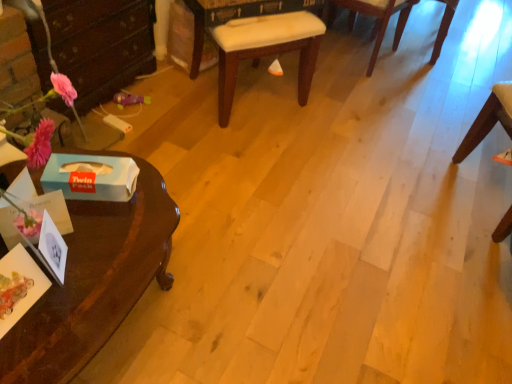
Measure the distance between point (45, 317) and camera.

They are 38.50 inches apart.

This screenshot has width=512, height=384. What do you see at coordinates (265, 49) in the screenshot?
I see `white fabric cushion at center, positioned as the first chair in left-to-right order` at bounding box center [265, 49].

Describe the element at coordinates (488, 120) in the screenshot. This screenshot has width=512, height=384. I see `wooden chair at right, acting as the second chair starting from the right` at that location.

Where is `glossy dark wood desk at left`? The height and width of the screenshot is (384, 512). glossy dark wood desk at left is located at coordinates (95, 281).

In the scene shown: Who is more distant, glossy dark wood desk at left or white cardboard box at lower left, which ranks as the 1th box in back-to-front order?

white cardboard box at lower left, which ranks as the 1th box in back-to-front order, is more distant.

Locate an element on the screen. desk below the white cardboard box at lower left, which ranks as the 1th box in back-to-front order (from the image's perspective) is located at coordinates click(x=95, y=281).

Is glossy dark wood desk at left directly adjacent to white cardboard box at lower left, the 2th box when ordered from front to back?

glossy dark wood desk at left and white cardboard box at lower left, the 2th box when ordered from front to back, are clearly separated.

Looking at this image, considering the sizes of objects glossy dark wood desk at left and white cardboard box at lower left, which ranks as the 1th box in back-to-front order, in the image provided, who is thinner, glossy dark wood desk at left or white cardboard box at lower left, which ranks as the 1th box in back-to-front order,?

white cardboard box at lower left, which ranks as the 1th box in back-to-front order.

From the image's perspective, which one is positioned higher, blue paper tissue box at left, positioned as the 1th box in front-to-back order, or wooden chair at right, acting as the second chair starting from the right?

wooden chair at right, acting as the second chair starting from the right, from the image's perspective.

From a real-world perspective, who is located higher, blue paper tissue box at left, positioned as the 1th box in front-to-back order, or wooden chair at right, acting as the second chair starting from the right?

blue paper tissue box at left, positioned as the 1th box in front-to-back order, from a real-world perspective.

Is blue paper tissue box at left, positioned as the 1th box in front-to-back order, oriented away from wooden chair at right, arranged as the second chair when viewed from the left?

No.

How many degrees apart are the facing directions of blue paper tissue box at left, the second box in the back-to-front sequence, and wooden chair at right, arranged as the second chair when viewed from the left?

The angular difference between blue paper tissue box at left, the second box in the back-to-front sequence, and wooden chair at right, arranged as the second chair when viewed from the left, is 124 degrees.

Which is further, (141, 268) or (233, 35)?

The point (233, 35) is farther.

Which object is further away from the camera, glossy dark wood desk at left or white fabric cushion at center, which ranks as the 3th chair in right-to-left order?

Positioned behind is white fabric cushion at center, which ranks as the 3th chair in right-to-left order.

Which of these two, glossy dark wood desk at left or white fabric cushion at center, positioned as the first chair in left-to-right order, stands shorter?

Standing shorter between the two is glossy dark wood desk at left.

How far apart are glossy dark wood desk at left and white fabric cushion at center, which ranks as the 3th chair in right-to-left order?

The distance of glossy dark wood desk at left from white fabric cushion at center, which ranks as the 3th chair in right-to-left order, is 1.10 meters.

From the image's perspective, is blue paper tissue box at left, positioned as the 1th box in front-to-back order, positioned above or below white fabric cushion at center, which ranks as the 3th chair in right-to-left order?

blue paper tissue box at left, positioned as the 1th box in front-to-back order, is situated lower than white fabric cushion at center, which ranks as the 3th chair in right-to-left order, in the image.

Considering the sizes of objects blue paper tissue box at left, the second box in the back-to-front sequence, and white fabric cushion at center, positioned as the first chair in left-to-right order, in the image provided, who is taller, blue paper tissue box at left, the second box in the back-to-front sequence, or white fabric cushion at center, positioned as the first chair in left-to-right order,?

white fabric cushion at center, positioned as the first chair in left-to-right order, is taller.

In the scene shown: Can you tell me how much blue paper tissue box at left, positioned as the 1th box in front-to-back order, and white fabric cushion at center, positioned as the first chair in left-to-right order, differ in facing direction?

blue paper tissue box at left, positioned as the 1th box in front-to-back order, and white fabric cushion at center, positioned as the first chair in left-to-right order, are facing 0.922 degrees away from each other.

Does blue paper tissue box at left, the second box in the back-to-front sequence, turn towards white fabric cushion at center, which ranks as the 3th chair in right-to-left order?

No, blue paper tissue box at left, the second box in the back-to-front sequence, is not aimed at white fabric cushion at center, which ranks as the 3th chair in right-to-left order.

Between wooden chair at right, arranged as the second chair when viewed from the left, and white fabric cushion at center, positioned as the first chair in left-to-right order, which one has smaller width?

Thinner between the two is wooden chair at right, arranged as the second chair when viewed from the left.

Considering the sizes of objects wooden chair at right, arranged as the second chair when viewed from the left, and white fabric cushion at center, positioned as the first chair in left-to-right order, in the image provided, who is shorter, wooden chair at right, arranged as the second chair when viewed from the left, or white fabric cushion at center, positioned as the first chair in left-to-right order,?

white fabric cushion at center, positioned as the first chair in left-to-right order, is shorter.

Is wooden chair at right, acting as the second chair starting from the right, positioned with its back to white fabric cushion at center, positioned as the first chair in left-to-right order?

No, wooden chair at right, acting as the second chair starting from the right, is not facing away from white fabric cushion at center, positioned as the first chair in left-to-right order.

Looking at the image, does wooden chair at right, arranged as the second chair when viewed from the left, seem bigger or smaller compared to white fabric cushion at center, which ranks as the 3th chair in right-to-left order?

Clearly, wooden chair at right, arranged as the second chair when viewed from the left, is smaller in size than white fabric cushion at center, which ranks as the 3th chair in right-to-left order.

Does wooden chair at right, arranged as the second chair when viewed from the left, have a greater height compared to glossy dark wood desk at left?

Yes, wooden chair at right, arranged as the second chair when viewed from the left, is taller than glossy dark wood desk at left.

How different are the orientations of wooden chair at right, arranged as the second chair when viewed from the left, and glossy dark wood desk at left in degrees?

The angular difference between wooden chair at right, arranged as the second chair when viewed from the left, and glossy dark wood desk at left is 156 degrees.

From a real-world perspective, is wooden chair at right, arranged as the second chair when viewed from the left, on glossy dark wood desk at left?

Yes, from a real-world perspective, wooden chair at right, arranged as the second chair when viewed from the left, is above glossy dark wood desk at left.

Does point (503, 121) come in front of point (442, 29)?

That is True.

Is wooden chair at right, arranged as the second chair when viewed from the left, bigger or smaller than wooden chair at upper right, which ranks as the first chair in right-to-left order?

Clearly, wooden chair at right, arranged as the second chair when viewed from the left, is smaller in size than wooden chair at upper right, which ranks as the first chair in right-to-left order.

Which object is closer to the camera taking this photo, wooden chair at right, acting as the second chair starting from the right, or wooden chair at upper right, the third chair in the left-to-right sequence?

Positioned in front is wooden chair at right, acting as the second chair starting from the right.

Is the surface of wooden chair at right, acting as the second chair starting from the right, in direct contact with wooden chair at upper right, which ranks as the first chair in right-to-left order?

No, wooden chair at right, acting as the second chair starting from the right, is not with wooden chair at upper right, which ranks as the first chair in right-to-left order.

This screenshot has width=512, height=384. What are the coordinates of `the 1st box positioned above the glossy dark wood desk at left (from a real-world perspective)` in the screenshot? It's located at (95, 177).

You are a GUI agent. You are given a task and a screenshot of the screen. Output one action in this format:
    pyautogui.click(x=<x>, y=<y>)
    Task: Click on the chair that is the 2nd one when counting rightward from the blue paper tissue box at left, the second box in the back-to-front sequence
    The image size is (512, 384).
    Given the screenshot: What is the action you would take?
    pyautogui.click(x=488, y=120)

When comparing their distances from glossy dark wood desk at left, does wooden chair at upper right, which ranks as the first chair in right-to-left order, or white fabric cushion at center, which ranks as the 3th chair in right-to-left order, seem closer?

The object closer to glossy dark wood desk at left is white fabric cushion at center, which ranks as the 3th chair in right-to-left order.

Which object lies further to the anchor point wooden chair at right, arranged as the second chair when viewed from the left, white cardboard box at lower left, the 2th box when ordered from front to back, or blue paper tissue box at left, the second box in the back-to-front sequence?

blue paper tissue box at left, the second box in the back-to-front sequence, is further to wooden chair at right, arranged as the second chair when viewed from the left.

Looking at the image, which one is located further to wooden chair at upper right, the third chair in the left-to-right sequence, white cardboard box at lower left, which ranks as the 1th box in back-to-front order, or glossy dark wood desk at left?

glossy dark wood desk at left.

Based on their spatial positions, is white fabric cushion at center, which ranks as the 3th chair in right-to-left order, or wooden chair at right, acting as the second chair starting from the right, closer to blue paper tissue box at left, positioned as the 1th box in front-to-back order?

The object closer to blue paper tissue box at left, positioned as the 1th box in front-to-back order, is white fabric cushion at center, which ranks as the 3th chair in right-to-left order.

Looking at the image, which one is located closer to blue paper tissue box at left, positioned as the 1th box in front-to-back order, wooden chair at upper right, which ranks as the first chair in right-to-left order, or wooden chair at right, arranged as the second chair when viewed from the left?

Among the two, wooden chair at right, arranged as the second chair when viewed from the left, is located nearer to blue paper tissue box at left, positioned as the 1th box in front-to-back order.

From the image, which object appears to be nearer to wooden chair at right, arranged as the second chair when viewed from the left, white fabric cushion at center, which ranks as the 3th chair in right-to-left order, or white cardboard box at lower left, which ranks as the 1th box in back-to-front order?

white fabric cushion at center, which ranks as the 3th chair in right-to-left order, is positioned closer to the anchor wooden chair at right, arranged as the second chair when viewed from the left.

When comparing their distances from blue paper tissue box at left, the second box in the back-to-front sequence, does white fabric cushion at center, positioned as the first chair in left-to-right order, or glossy dark wood desk at left seem further?

white fabric cushion at center, positioned as the first chair in left-to-right order.

Which object lies further to the anchor point wooden chair at upper right, the third chair in the left-to-right sequence, white fabric cushion at center, which ranks as the 3th chair in right-to-left order, or blue paper tissue box at left, the second box in the back-to-front sequence?

Among the two, blue paper tissue box at left, the second box in the back-to-front sequence, is located further to wooden chair at upper right, the third chair in the left-to-right sequence.

Locate an element on the screen. box situated between blue paper tissue box at left, the second box in the back-to-front sequence, and wooden chair at right, arranged as the second chair when viewed from the left, from left to right is located at coordinates (95, 177).

The width and height of the screenshot is (512, 384). Identify the location of chair situated between glossy dark wood desk at left and wooden chair at right, arranged as the second chair when viewed from the left, from left to right. (265, 49).

Find the location of a particular element. Image resolution: width=512 pixels, height=384 pixels. chair between blue paper tissue box at left, positioned as the 1th box in front-to-back order, and wooden chair at right, acting as the second chair starting from the right is located at coordinates (265, 49).

Where is `chair between white cardboard box at lower left, which ranks as the 1th box in back-to-front order, and wooden chair at right, acting as the second chair starting from the right, from left to right`? chair between white cardboard box at lower left, which ranks as the 1th box in back-to-front order, and wooden chair at right, acting as the second chair starting from the right, from left to right is located at coordinates tap(265, 49).